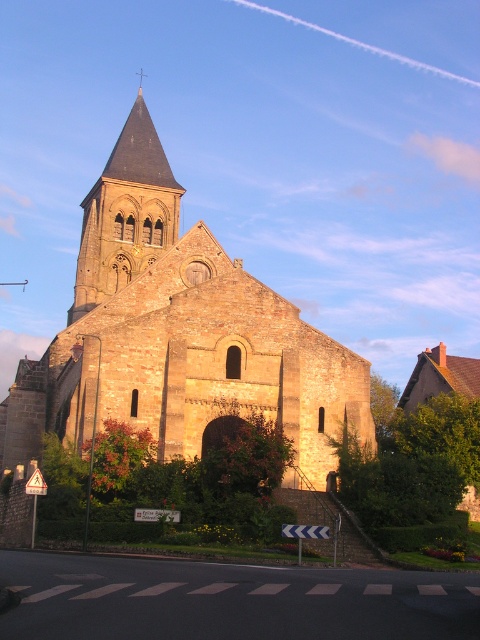
Does point (145, 161) lie behind point (137, 74)?

That is False.

Which of these two, golden stone tower at upper center or gold stone spire at upper center, stands taller?

With more height is golden stone tower at upper center.

Which is in front, point (86, 196) or point (141, 84)?

Point (86, 196)

Where is `golden stone tower at upper center`? This screenshot has height=640, width=480. golden stone tower at upper center is located at coordinates (126, 212).

Does yellow stone church at center have a lesser height compared to gold stone spire at upper center?

No.

How distant is yellow stone church at center from gold stone spire at upper center?

yellow stone church at center is 123.33 meters away from gold stone spire at upper center.

Is point (133, 260) in front of point (142, 76)?

Yes, it is.

In order to click on yellow stone church at center in this screenshot , I will do `click(178, 333)`.

Is yellow stone church at center further to camera compared to golden stone tower at upper center?

No, yellow stone church at center is closer to the viewer.

Describe the element at coordinates (178, 333) in the screenshot. This screenshot has height=640, width=480. I see `yellow stone church at center` at that location.

Identify the location of yellow stone church at center. The width and height of the screenshot is (480, 640). (178, 333).

Where is `yellow stone church at center`? The image size is (480, 640). yellow stone church at center is located at coordinates (178, 333).